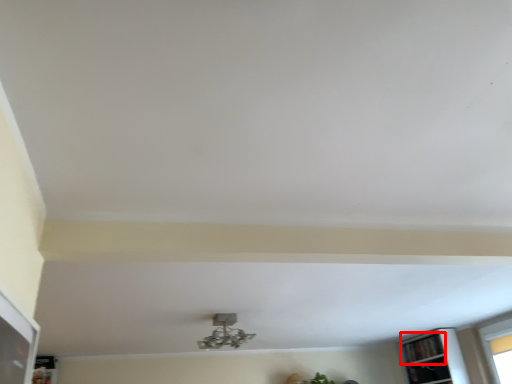
Question: From the image's perspective, where is shelf (annotated by the red box) located relative to lamp?

Choices:
 (A) above
 (B) below

Answer: (B)